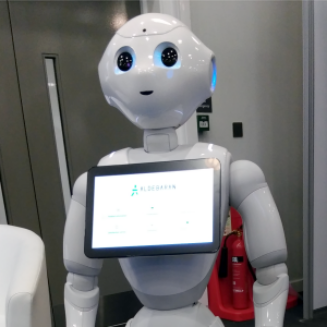
I want to click on tablet screen, so click(116, 202).